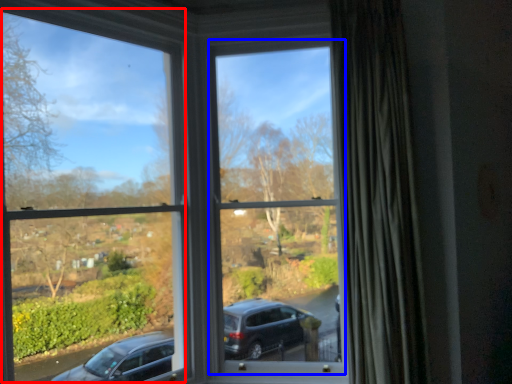
Question: Which point is further to the camera, window frame (highlighted by a red box) or window frame (highlighted by a blue box)?

Choices:
 (A) window frame
 (B) window frame

Answer: (B)